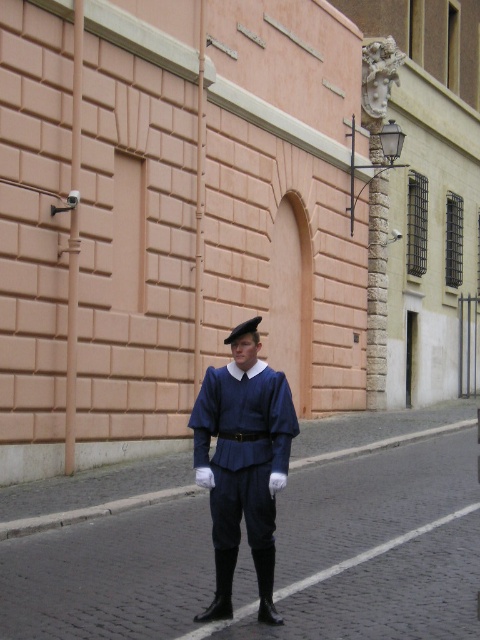
Question: Considering the relative positions of matte blue uniform at center and black felt hat at center in the image provided, where is matte blue uniform at center located with respect to black felt hat at center?

Choices:
 (A) below
 (B) above

Answer: (A)

Question: Does matte blue uniform at center appear over black felt hat at center?

Choices:
 (A) yes
 (B) no

Answer: (B)

Question: Is the position of matte blue uniform at center less distant than that of black felt hat at center?

Choices:
 (A) yes
 (B) no

Answer: (A)

Question: Which point is closer to the camera taking this photo?

Choices:
 (A) (205, 461)
 (B) (247, 323)

Answer: (B)